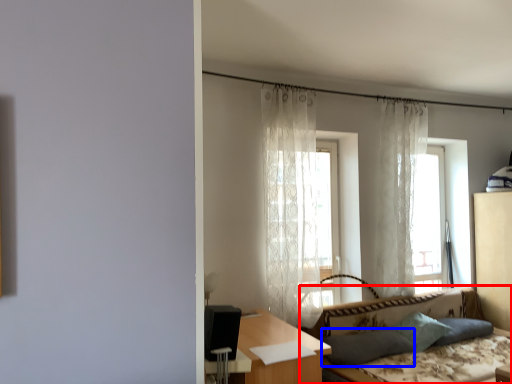
Question: Which point is further to the camera, studio couch (highlighted by a red box) or pillow (highlighted by a blue box)?

Choices:
 (A) studio couch
 (B) pillow

Answer: (B)